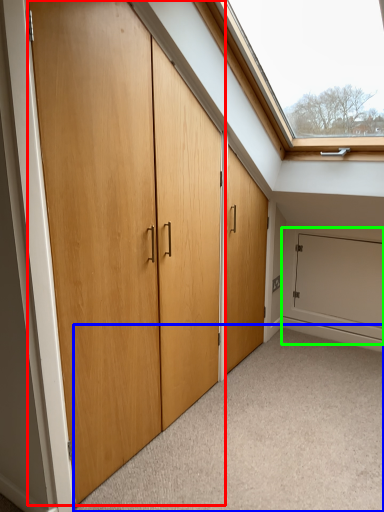
Question: Which object is the farthest from door (highlighted by a red box)? Choose among these: plain (highlighted by a blue box) or garage door (highlighted by a green box).

Choices:
 (A) plain
 (B) garage door

Answer: (B)